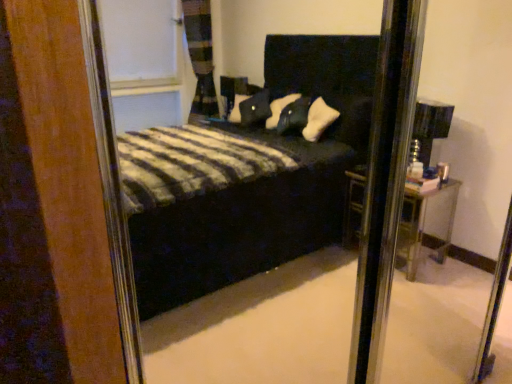
The image size is (512, 384). What do you see at coordinates (385, 180) in the screenshot? I see `metallic silver screen door at right` at bounding box center [385, 180].

You are a GUI agent. You are given a task and a screenshot of the screen. Output one action in this format:
    pyautogui.click(x=<x>, y=<y>)
    Task: Click on the metallic silver screen door at right
    The height and width of the screenshot is (384, 512).
    Given the screenshot: What is the action you would take?
    pos(385,180)

Measure the distance between point (380,91) and camera.

A distance of 3.52 feet exists between point (380,91) and camera.

I want to click on metallic silver screen door at right, so click(385, 180).